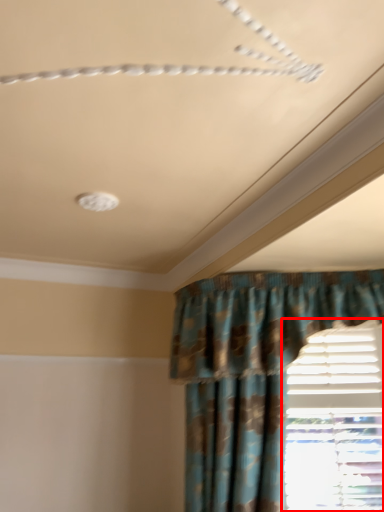
Question: From the image's perspective, what is the correct spatial positioning of window (annotated by the red box) in reference to curtain?

Choices:
 (A) above
 (B) below

Answer: (B)